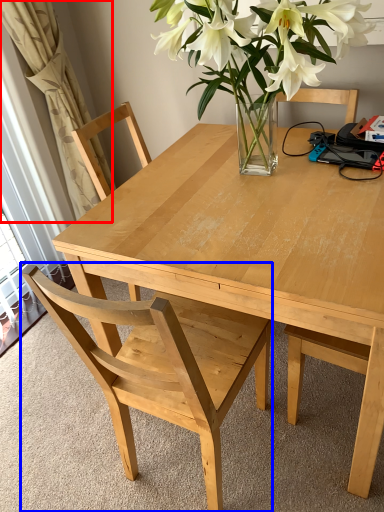
Question: Which object appears closest to the camera in this image, curtain (highlighted by a red box) or chair (highlighted by a blue box)?

Choices:
 (A) curtain
 (B) chair

Answer: (B)